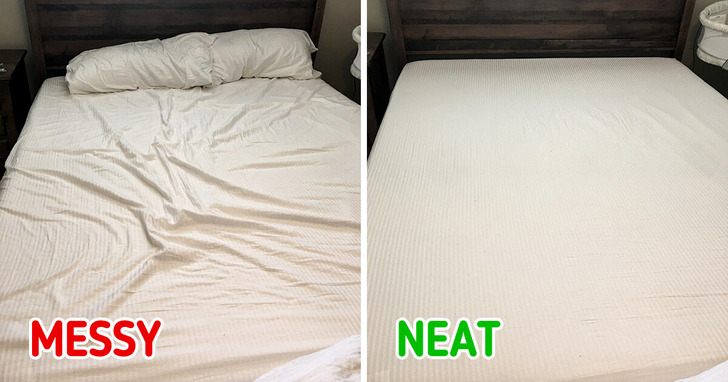
At what (x,y) coordinates should I click in order to perform the action: click on wooden nightstand. Please return your answer as a coordinate pair (x, y). This screenshot has height=382, width=728. Looking at the image, I should click on (371, 66), (12, 79).